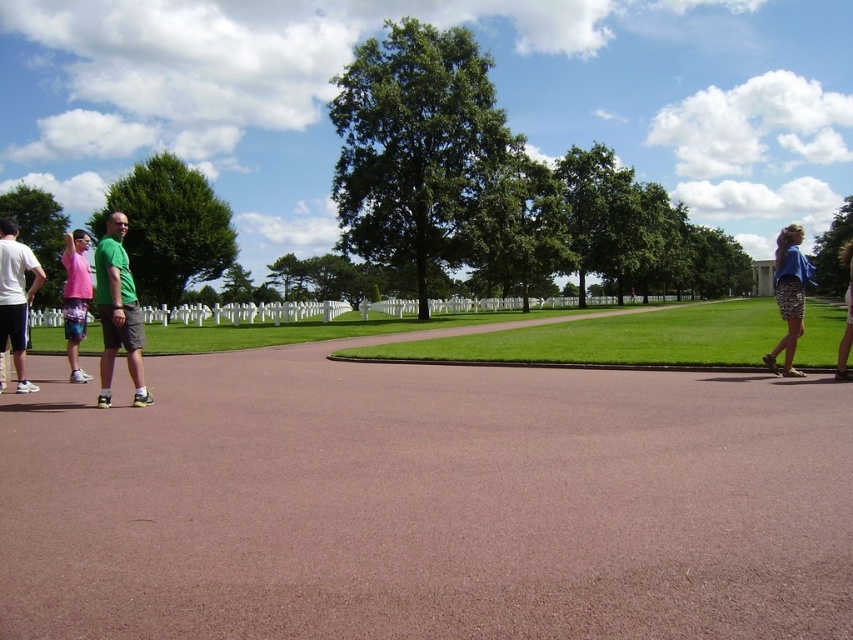
Question: Does green matte shorts at center come behind white matte shorts at left?

Choices:
 (A) yes
 (B) no

Answer: (B)

Question: Which object is positioned farthest from the pink fabric shirt at left?

Choices:
 (A) matte blue dress at right
 (B) white matte shorts at left
 (C) blue printed skirt at right
 (D) green matte shorts at center

Answer: (A)

Question: Which of the following is the farthest from the observer?

Choices:
 (A) (80, 314)
 (B) (845, 365)
 (C) (718, 509)

Answer: (A)

Question: Considering the relative positions of green matte shorts at center and matte blue dress at right in the image provided, where is green matte shorts at center located with respect to matte blue dress at right?

Choices:
 (A) above
 (B) below

Answer: (B)

Question: Observing the image, what is the correct spatial positioning of white matte shorts at left in reference to pink fabric shirt at left?

Choices:
 (A) right
 (B) left

Answer: (A)

Question: Which point appears farthest from the camera in this image?

Choices:
 (A) (0, 228)
 (B) (115, 310)
 (C) (844, 376)

Answer: (C)